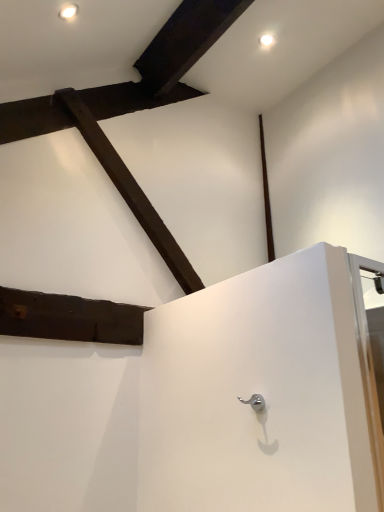
Image resolution: width=384 pixels, height=512 pixels. Describe the element at coordinates (69, 318) in the screenshot. I see `dark brown wood at upper left` at that location.

Locate an element on the screen. dark brown wood at upper left is located at coordinates (69, 318).

I want to click on dark brown wood at upper left, so click(x=69, y=318).